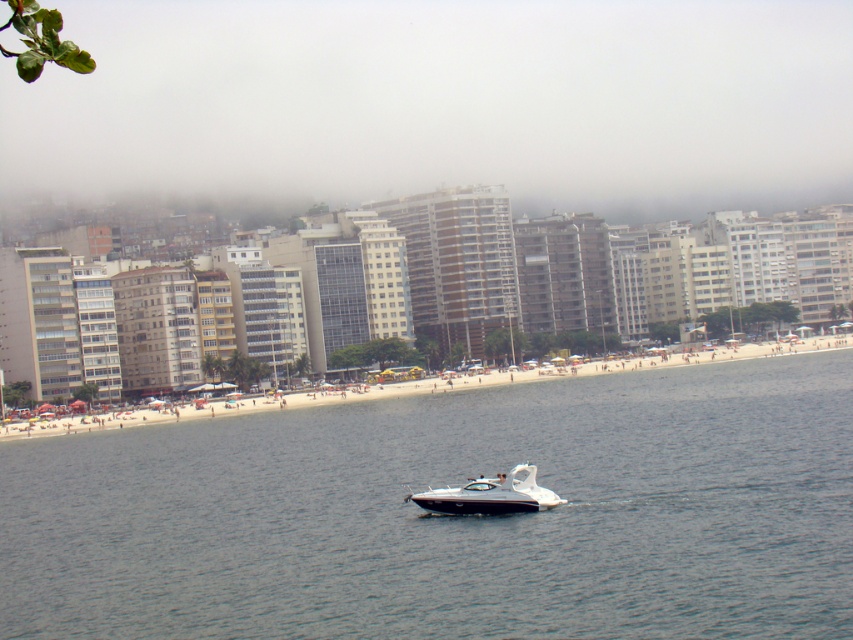
Is clear blue water at center below white sand beach at center?

Indeed, clear blue water at center is positioned under white sand beach at center.

Is point (369, 545) less distant than point (752, 355)?

Yes, point (369, 545) is in front of point (752, 355).

Locate an element on the screen. The image size is (853, 640). clear blue water at center is located at coordinates (451, 516).

Can you confirm if clear blue water at center is positioned above white glossy speedboat at center?

Actually, clear blue water at center is below white glossy speedboat at center.

Is clear blue water at center to the right of white glossy speedboat at center from the viewer's perspective?

Incorrect, clear blue water at center is not on the right side of white glossy speedboat at center.

You are a GUI agent. You are given a task and a screenshot of the screen. Output one action in this format:
    pyautogui.click(x=<x>, y=<y>)
    Task: Click on the clear blue water at center
    Image resolution: width=853 pixels, height=640 pixels.
    Given the screenshot: What is the action you would take?
    pyautogui.click(x=451, y=516)

Is white sand beach at center above white glossy speedboat at center?

Yes.

Which is behind, point (189, 419) or point (489, 477)?

Point (189, 419)

Where is `white sand beach at center`? white sand beach at center is located at coordinates (525, 378).